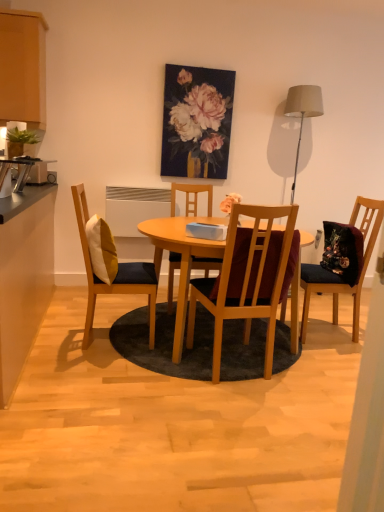
I want to click on free space on the front side of wooden chair at center, the third chair in the left-to-right sequence, so click(235, 407).